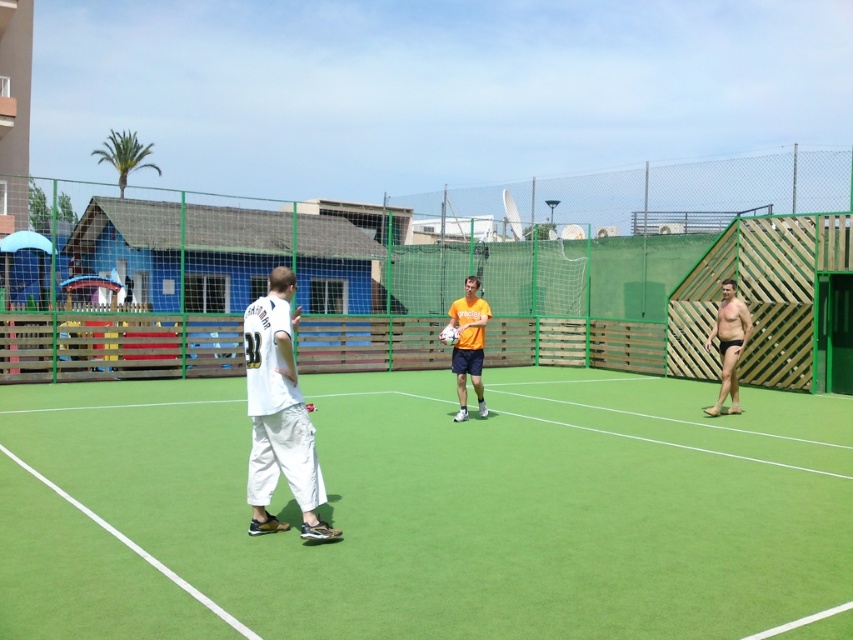
Question: Does green artificial turf at center appear over orange matte shirt at center?

Choices:
 (A) yes
 (B) no

Answer: (B)

Question: Which object is farther from the camera taking this photo?

Choices:
 (A) orange matte shirt at center
 (B) white cotton pants at center
 (C) black matte shorts at right

Answer: (C)

Question: Which object is closer to the camera taking this photo?

Choices:
 (A) orange matte shirt at center
 (B) black matte shorts at right
 (C) white cotton pants at center

Answer: (C)

Question: Is green artificial turf at center wider than orange matte shirt at center?

Choices:
 (A) yes
 (B) no

Answer: (A)

Question: Among these points, which one is farthest from the camera?

Choices:
 (A) (732, 346)
 (B) (468, 307)
 (C) (202, 522)
 (D) (297, 442)

Answer: (A)

Question: Observing the image, what is the correct spatial positioning of white cotton pants at center in reference to black matte shorts at right?

Choices:
 (A) above
 (B) below

Answer: (B)